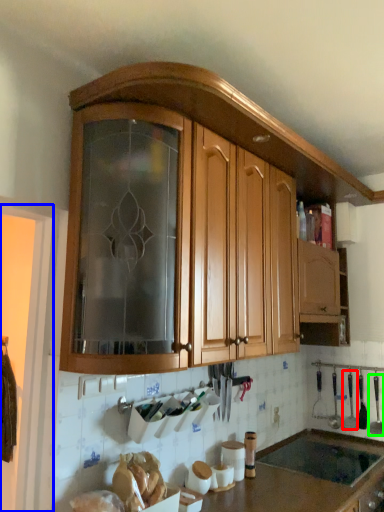
Question: Estimate the real-world distances between objects in this image. Which object is farther from silverware (highlighted by a red box), screen door (highlighted by a blue box) or silverware (highlighted by a green box)?

Choices:
 (A) screen door
 (B) silverware

Answer: (A)